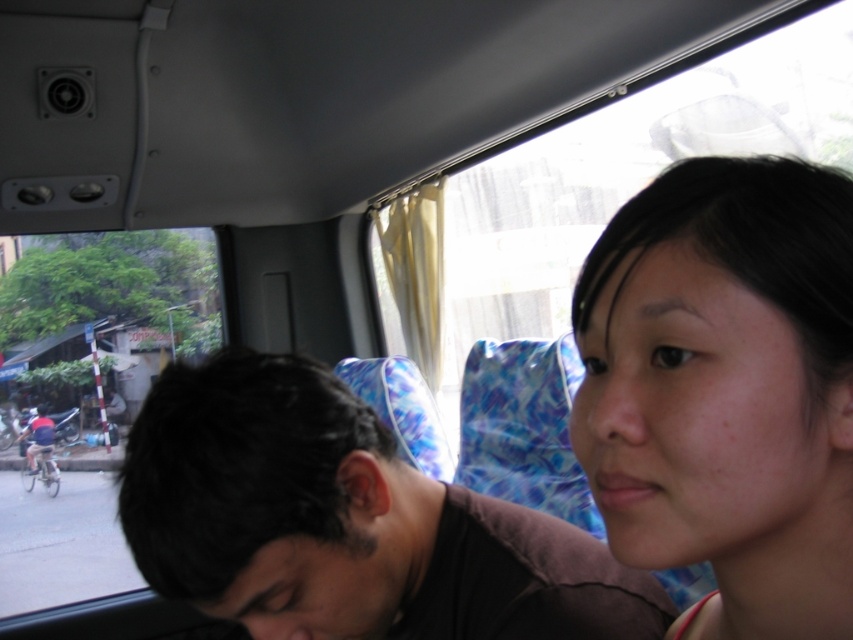
You are a passenger in the vehicle and want to check the time on your phone without moving your head. Which object, the smooth skin face at center or the transparent glass window at left, would allow you to see your reflection better?

The transparent glass window at left is taller than the smooth skin face at center, so it would provide a larger reflective surface for checking the time on your phone.

You are a passenger in the vehicle and need to reach a small item that fell near the two points mentioned. Which point, point [442,502] or point [3,451], is closer to you?

Point [3,451] is closer to you because it is behind point [442,502].

From the picture: You are a passenger in the vehicle and want to look out the transparent glass window at left without moving your head. Can you see the smooth skin face at center in your line of sight when looking at the window?

The smooth skin face at center is located above the transparent glass window at left, so when looking at the window, the smooth skin face at center would be in your line of sight blocking the view.